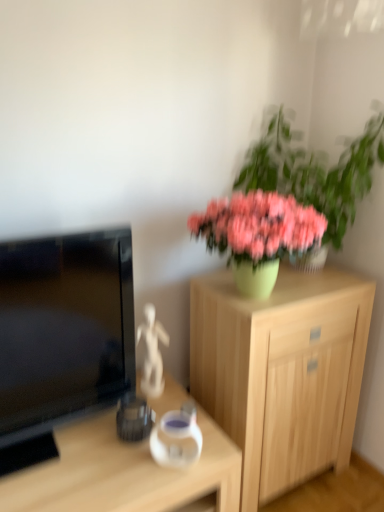
Question: Can you see matte black television at left touching transparent glass vase at center?

Choices:
 (A) no
 (B) yes

Answer: (A)

Question: Can we say matte black television at left lies outside transparent glass vase at center?

Choices:
 (A) yes
 (B) no

Answer: (A)

Question: From a real-world perspective, is matte black television at left on top of transparent glass vase at center?

Choices:
 (A) no
 (B) yes

Answer: (B)

Question: Can you confirm if matte black television at left is taller than transparent glass vase at center?

Choices:
 (A) no
 (B) yes

Answer: (B)

Question: Does matte black television at left come in front of transparent glass vase at center?

Choices:
 (A) yes
 (B) no

Answer: (A)

Question: Does matte black television at left have a larger size compared to transparent glass vase at center?

Choices:
 (A) no
 (B) yes

Answer: (B)

Question: Is light wood cabinet at center not near matte black television at left?

Choices:
 (A) yes
 (B) no

Answer: (B)

Question: Is light wood cabinet at center positioned in front of matte black television at left?

Choices:
 (A) no
 (B) yes

Answer: (A)

Question: Is light wood cabinet at center facing away from matte black television at left?

Choices:
 (A) yes
 (B) no

Answer: (B)

Question: Is the position of light wood cabinet at center more distant than that of matte black television at left?

Choices:
 (A) yes
 (B) no

Answer: (A)

Question: Is light wood cabinet at center smaller than matte black television at left?

Choices:
 (A) no
 (B) yes

Answer: (A)

Question: Could you tell me if light wood cabinet at center is facing matte black television at left?

Choices:
 (A) yes
 (B) no

Answer: (B)

Question: Is matte black television at left taller than green matte vase at upper right?

Choices:
 (A) no
 (B) yes

Answer: (A)